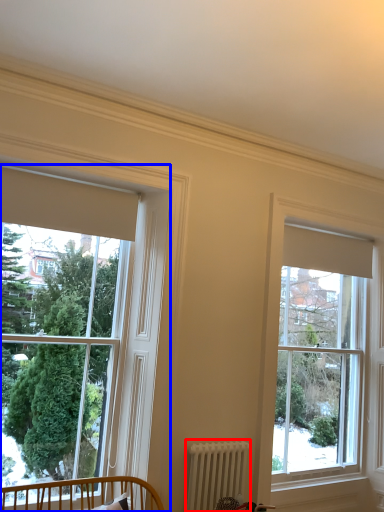
Question: Which object is closer to the camera taking this photo, radiator (highlighted by a red box) or window (highlighted by a blue box)?

Choices:
 (A) radiator
 (B) window

Answer: (B)